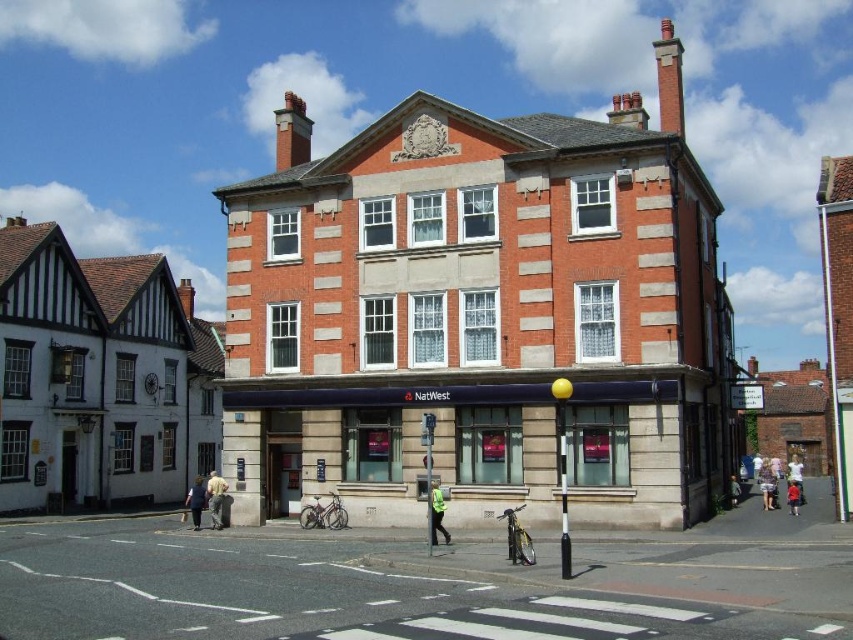
Question: Can you confirm if high visibility yellow jacket at center is bigger than light blue denim jacket at center?

Choices:
 (A) yes
 (B) no

Answer: (B)

Question: Considering the real-world distances, which object is closest to the high visibility yellow jacket at center?

Choices:
 (A) asphalt road at lower center
 (B) dark blue jeans at lower right

Answer: (A)

Question: Can you confirm if khaki cotton pants at lower center is positioned below dark blue jeans at lower right?

Choices:
 (A) yes
 (B) no

Answer: (A)

Question: Is asphalt road at lower center wider than dark blue jeans at lower right?

Choices:
 (A) no
 (B) yes

Answer: (B)

Question: Which point is farther from the camera taking this photo?

Choices:
 (A) (447, 534)
 (B) (796, 508)
 (C) (86, 614)
 (D) (764, 493)

Answer: (D)

Question: Which of the following is the closest to the observer?

Choices:
 (A) dark blue jeans at lower right
 (B) khaki cotton pants at lower center

Answer: (A)